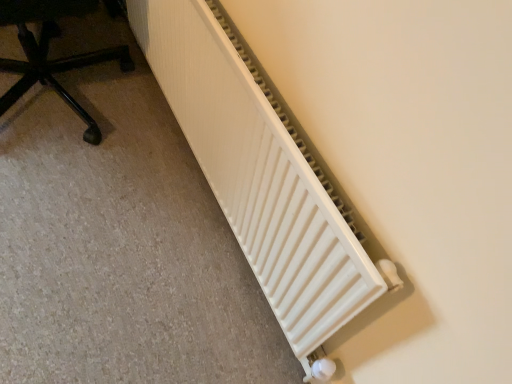
Question: Is there a large distance between white matte radiator at lower right and black plastic chair at lower left?

Choices:
 (A) no
 (B) yes

Answer: (A)

Question: Is white matte radiator at lower right thinner than black plastic chair at lower left?

Choices:
 (A) yes
 (B) no

Answer: (A)

Question: Is the depth of white matte radiator at lower right greater than that of black plastic chair at lower left?

Choices:
 (A) no
 (B) yes

Answer: (A)

Question: Does white matte radiator at lower right have a larger size compared to black plastic chair at lower left?

Choices:
 (A) yes
 (B) no

Answer: (B)

Question: Is white matte radiator at lower right in front of black plastic chair at lower left?

Choices:
 (A) no
 (B) yes

Answer: (B)

Question: Can you confirm if white matte radiator at lower right is shorter than black plastic chair at lower left?

Choices:
 (A) no
 (B) yes

Answer: (A)

Question: From a real-world perspective, is black plastic chair at lower left physically below white matte radiator at lower right?

Choices:
 (A) no
 (B) yes

Answer: (B)

Question: Is black plastic chair at lower left at the right side of white matte radiator at lower right?

Choices:
 (A) yes
 (B) no

Answer: (B)

Question: Is black plastic chair at lower left far away from white matte radiator at lower right?

Choices:
 (A) yes
 (B) no

Answer: (B)

Question: From a real-world perspective, is black plastic chair at lower left located higher than white matte radiator at lower right?

Choices:
 (A) yes
 (B) no

Answer: (B)

Question: Considering the relative sizes of black plastic chair at lower left and white matte radiator at lower right in the image provided, is black plastic chair at lower left shorter than white matte radiator at lower right?

Choices:
 (A) yes
 (B) no

Answer: (A)

Question: Could you tell me if black plastic chair at lower left is facing white matte radiator at lower right?

Choices:
 (A) no
 (B) yes

Answer: (A)

Question: From the image's perspective, is white matte radiator at lower right located above or below black plastic chair at lower left?

Choices:
 (A) above
 (B) below

Answer: (B)